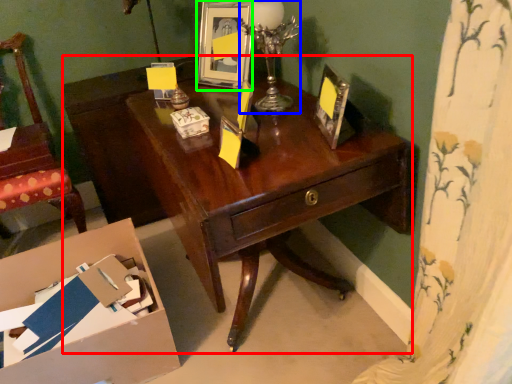
Question: Which object is the farthest from desk (highlighted by a red box)? Choose among these: candle holder (highlighted by a blue box) or picture frame (highlighted by a green box).

Choices:
 (A) candle holder
 (B) picture frame

Answer: (A)